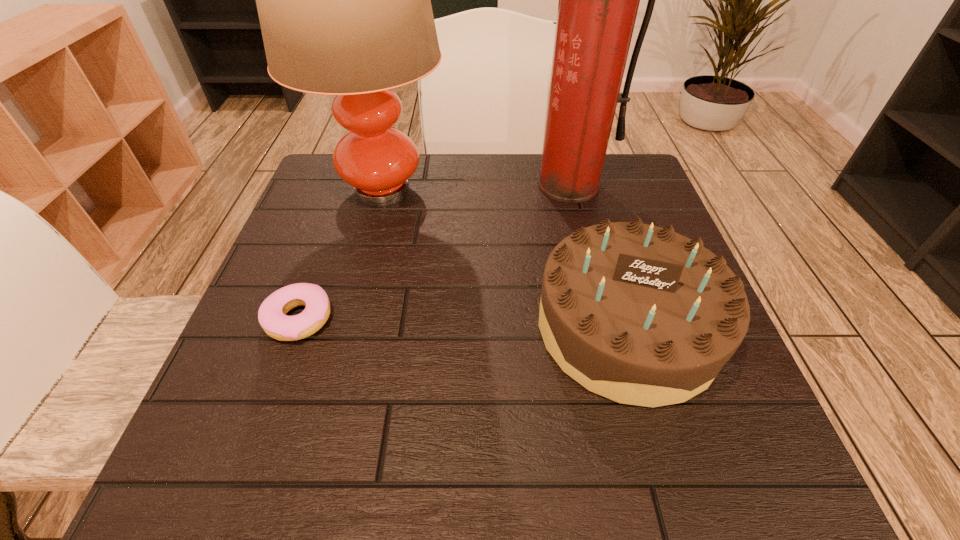
Find the location of a particular element. lamp that is at the left edge is located at coordinates (344, 0).

Image resolution: width=960 pixels, height=540 pixels. Find the location of `doughnut present at the left edge`. doughnut present at the left edge is located at coordinates (272, 317).

Locate an element on the screen. fire extinguisher that is at the right edge is located at coordinates (598, 3).

Identify the location of birthday cake at the right edge. The width and height of the screenshot is (960, 540). (639, 314).

You are a GUI agent. You are given a task and a screenshot of the screen. Output one action in this format:
    pyautogui.click(x=<x>, y=<y>)
    Task: Click on the object that is at the far left corner
    The height and width of the screenshot is (540, 960).
    Given the screenshot: What is the action you would take?
    pyautogui.click(x=344, y=0)

You are a GUI agent. You are given a task and a screenshot of the screen. Output one action in this format:
    pyautogui.click(x=<x>, y=<y>)
    Task: Click on the object present at the far right corner
    
    Given the screenshot: What is the action you would take?
    pyautogui.click(x=598, y=3)

This screenshot has width=960, height=540. In order to click on free space at the far edge of the desktop in this screenshot , I will do `click(433, 162)`.

In the image, there is a desktop. In order to click on vacant space at the near edge in this screenshot , I will do `click(457, 437)`.

Identify the location of vacant region at the left edge of the desktop. (304, 248).

At what (x,y) coordinates should I click in order to perform the action: click on blank space at the near left corner of the desktop. Please return your answer as a coordinate pair (x, y). Looking at the image, I should click on (290, 472).